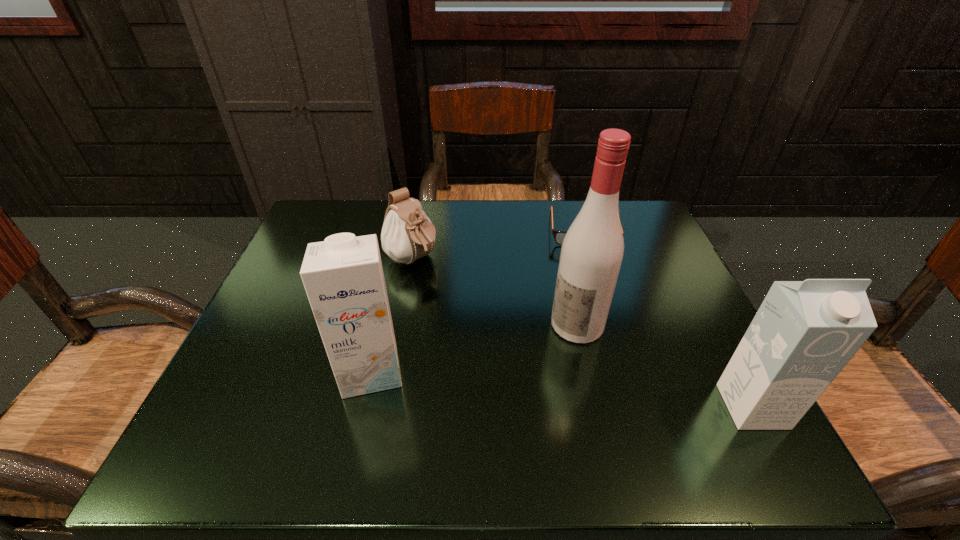
Where is `the left carton`? The width and height of the screenshot is (960, 540). the left carton is located at coordinates (343, 277).

Locate an element on the screen. This screenshot has width=960, height=540. the right carton is located at coordinates (804, 333).

You are a GUI agent. You are given a task and a screenshot of the screen. Output one action in this format:
    pyautogui.click(x=<x>, y=<y>)
    Task: Click on the shortest object
    The image size is (960, 540).
    Given the screenshot: What is the action you would take?
    pyautogui.click(x=559, y=236)

This screenshot has height=540, width=960. I want to click on the tallest object, so click(592, 251).

Image resolution: width=960 pixels, height=540 pixels. Find the location of `pouch`. pouch is located at coordinates (407, 235).

Locate an element on the screen. free space located 0.370m on the back of the left carton is located at coordinates (402, 231).

The image size is (960, 540). Find the location of `vacant space located on the front-facing side of the shortest object`. vacant space located on the front-facing side of the shortest object is located at coordinates (596, 348).

This screenshot has width=960, height=540. I want to click on blank area located 0.050m on the front-facing side of the shortest object, so click(587, 264).

The image size is (960, 540). Identify the location of free spot located 0.330m on the front-facing side of the shortest object. (598, 361).

Find the location of a particular element. Image resolution: width=960 pixels, height=540 pixels. free space located 0.080m on the label of the tallest object is located at coordinates (532, 360).